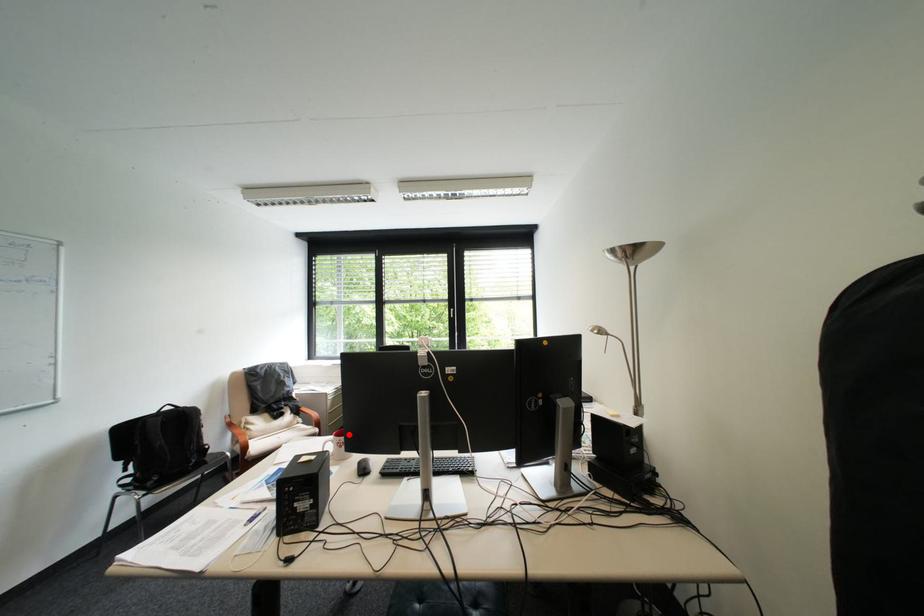
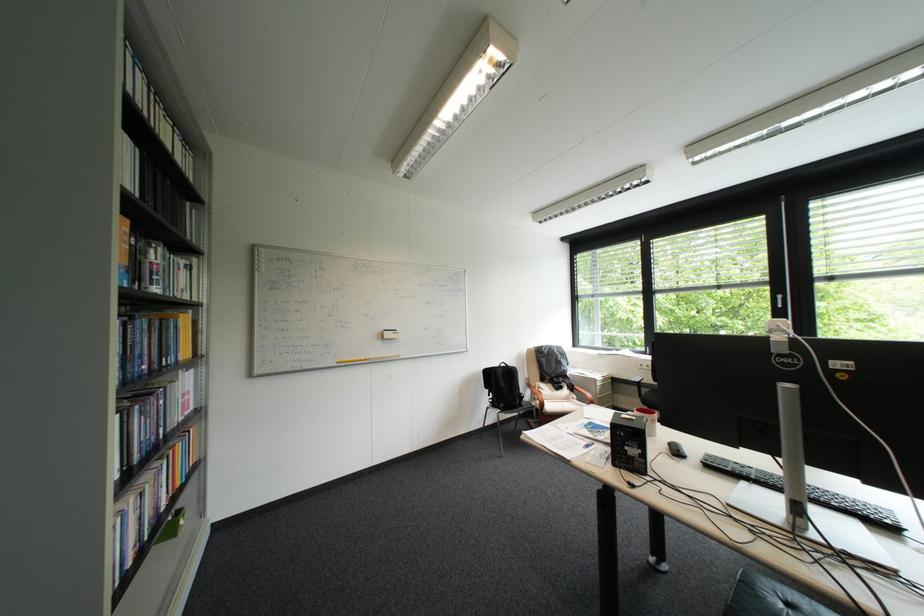
Where in the second image is the point corresponding to the highlighted location from the first image?

(650, 411)